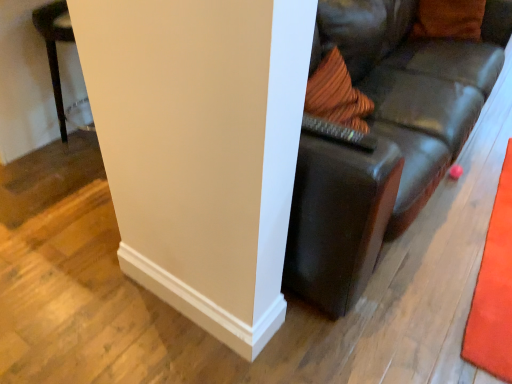
Question: From the image's perspective, does orange carpet at right appear higher than leather couch at center?

Choices:
 (A) no
 (B) yes

Answer: (A)

Question: Considering the relative positions of orange carpet at right and leather couch at center in the image provided, is orange carpet at right to the left of leather couch at center from the viewer's perspective?

Choices:
 (A) yes
 (B) no

Answer: (A)

Question: Can you confirm if orange carpet at right is thinner than leather couch at center?

Choices:
 (A) yes
 (B) no

Answer: (A)

Question: Can you confirm if orange carpet at right is wider than leather couch at center?

Choices:
 (A) yes
 (B) no

Answer: (B)

Question: Could you tell me if orange carpet at right is facing leather couch at center?

Choices:
 (A) yes
 (B) no

Answer: (A)

Question: Would you say orange fabric pillow at upper right is inside or outside white smooth wall at center?

Choices:
 (A) inside
 (B) outside

Answer: (B)

Question: From a real-world perspective, relative to white smooth wall at center, is orange fabric pillow at upper right vertically above or below?

Choices:
 (A) above
 (B) below

Answer: (A)

Question: Considering the positions of orange fabric pillow at upper right and white smooth wall at center in the image, is orange fabric pillow at upper right wider or thinner than white smooth wall at center?

Choices:
 (A) wide
 (B) thin

Answer: (B)

Question: In the image, is orange fabric pillow at upper right positioned in front of or behind white smooth wall at center?

Choices:
 (A) front
 (B) behind

Answer: (B)

Question: In terms of width, does orange carpet at right look wider or thinner when compared to white smooth wall at center?

Choices:
 (A) wide
 (B) thin

Answer: (B)

Question: Is orange carpet at right in front of or behind white smooth wall at center in the image?

Choices:
 (A) behind
 (B) front

Answer: (A)

Question: Considering the positions of orange carpet at right and white smooth wall at center in the image, is orange carpet at right bigger or smaller than white smooth wall at center?

Choices:
 (A) big
 (B) small

Answer: (B)

Question: Considering the positions of point (477, 332) and point (109, 49), is point (477, 332) closer or farther from the camera than point (109, 49)?

Choices:
 (A) farther
 (B) closer

Answer: (A)

Question: Considering the positions of leather couch at center and orange carpet at right in the image, is leather couch at center bigger or smaller than orange carpet at right?

Choices:
 (A) big
 (B) small

Answer: (A)

Question: From their relative heights in the image, would you say leather couch at center is taller or shorter than orange carpet at right?

Choices:
 (A) tall
 (B) short

Answer: (A)